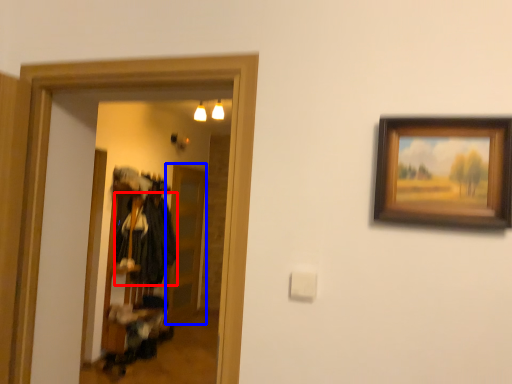
Question: Which object appears farthest to the camera in this image, clothing (highlighted by a red box) or glass door (highlighted by a blue box)?

Choices:
 (A) clothing
 (B) glass door

Answer: (B)